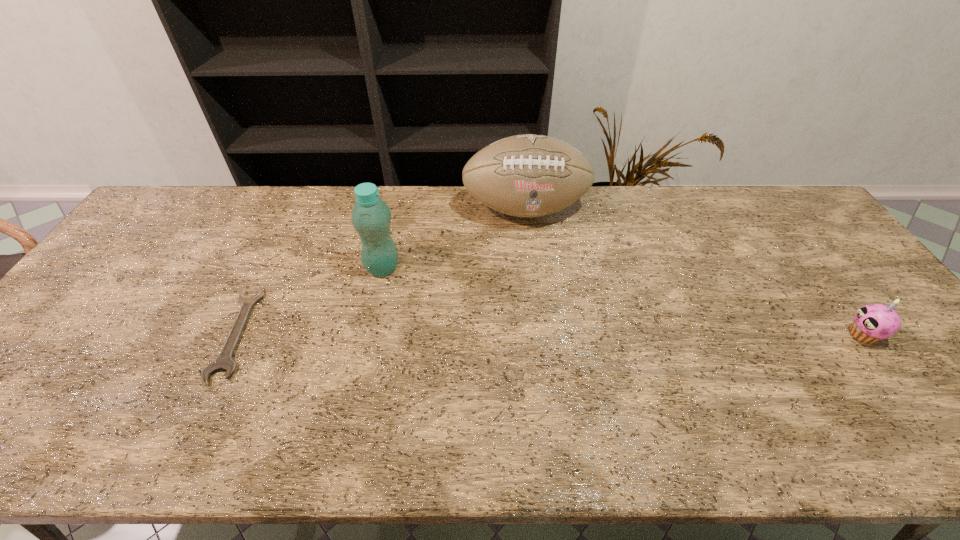
Identify the location of the shortest object. (224, 362).

Locate an element on the screen. wrench is located at coordinates (224, 362).

This screenshot has width=960, height=540. What are the coordinates of `the third tallest object` in the screenshot? It's located at (874, 322).

Locate an element on the screen. This screenshot has height=540, width=960. cupcake is located at coordinates (874, 322).

The width and height of the screenshot is (960, 540). I want to click on water bottle, so click(x=371, y=216).

Identify the location of the third object from right to left. (371, 216).

Identify the location of the third object from left to right. (529, 175).

Locate an element on the screen. the farthest object is located at coordinates (529, 175).

I want to click on free space located on the left of the shortest object, so click(x=112, y=333).

Where is `free region located 0.390m on the face of the third tallest object`? free region located 0.390m on the face of the third tallest object is located at coordinates (693, 335).